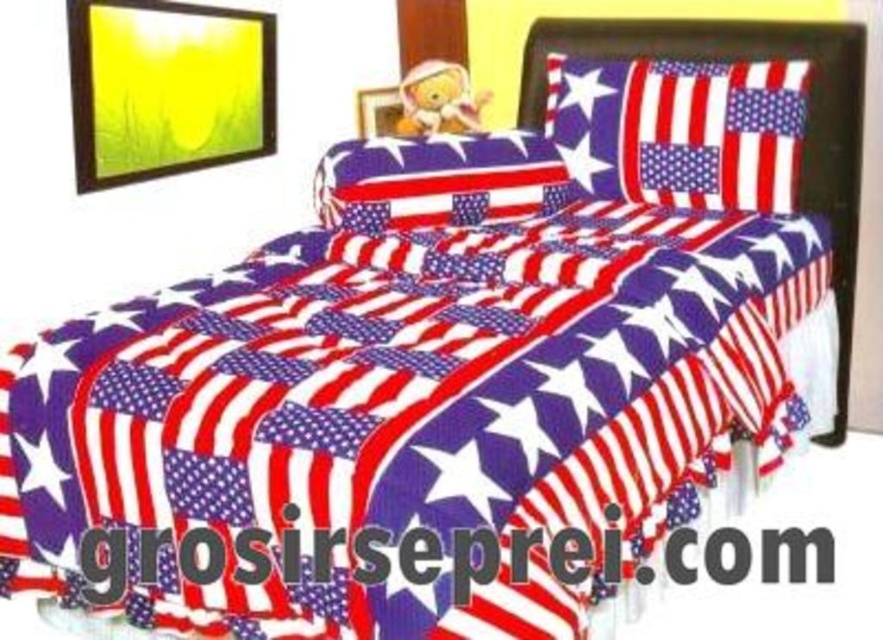
You are arranging a patriotic themed bedroom and need to place the american flag fabric at upper right and the metallic gold picture frame at upper center. According to the scene, which object is positioned to the right side?

The american flag fabric at upper right is positioned to the right of the metallic gold picture frame at upper center, so the american flag fabric at upper right is on the right side.

You are arranging a patriotic themed bedroom and need to place the american flag fabric at upper right and the american flag fabric pillow at center. Which object is taller?

The american flag fabric at upper right is taller than the american flag fabric pillow at center.

You are arranging a patriotic themed bedroom and need to place the american flag fabric pillow at center and the metallic gold picture frame at upper center. Considering their sizes, which one should you place first to ensure proper visibility of both items?

Since the american flag fabric pillow at center is taller than the metallic gold picture frame at upper center, you should place the metallic gold picture frame at upper center first to ensure it doesn not block the view of the taller pillow.